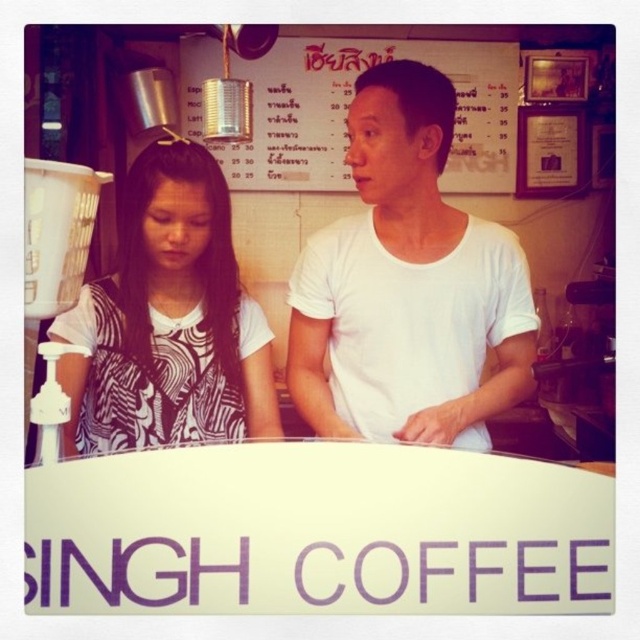
Between white matte shirt at center and metallic tin can at upper center, which one appears on the right side from the viewer's perspective?

white matte shirt at center

Is point (522, 269) closer to camera compared to point (332, 51)?

That is True.

Locate an element on the screen. white matte shirt at center is located at coordinates (406, 285).

Which of these two, white matte shirt at center or white printed shirt at left, stands taller?

white matte shirt at center

Can you confirm if white matte shirt at center is positioned below white printed shirt at left?

No.

Who is more distant from viewer, (390, 385) or (132, 320)?

The point (390, 385) is more distant.

Locate an element on the screen. The width and height of the screenshot is (640, 640). white matte shirt at center is located at coordinates (406, 285).

Based on the photo, who is positioned more to the left, white printed shirt at left or metallic tin can at upper center?

white printed shirt at left

Does point (115, 305) come farther from viewer compared to point (244, 163)?

That is False.

Find the location of `white printed shirt at left`. white printed shirt at left is located at coordinates (168, 321).